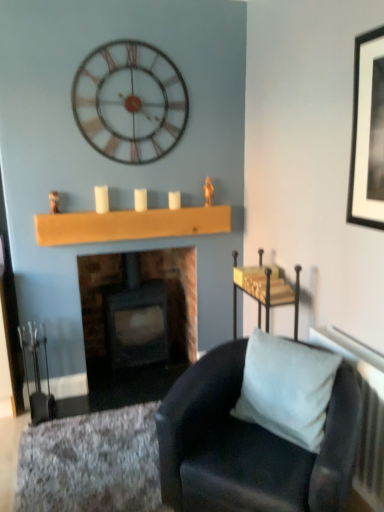
You are a GUI agent. You are given a task and a screenshot of the screen. Output one action in this format:
    pyautogui.click(x=<x>, y=<y>)
    Task: Click on the empty space that is ontop of white textured radiator at lower right
    Image resolution: width=384 pixels, height=512 pixels.
    Given the screenshot: What is the action you would take?
    pyautogui.click(x=354, y=336)